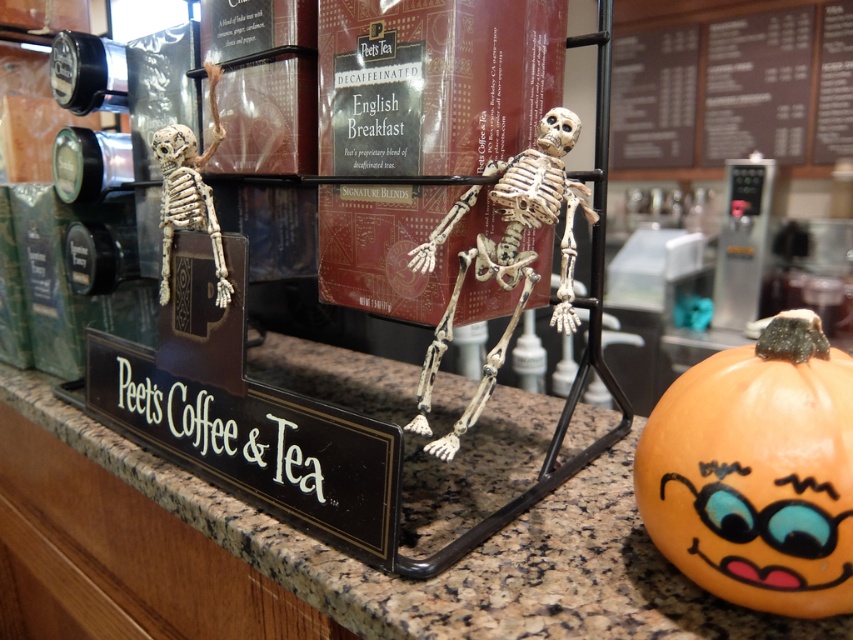
Question: Is the position of orange painted pumpkin at lower right less distant than that of dark brown wooden menu at upper right?

Choices:
 (A) no
 (B) yes

Answer: (B)

Question: Considering the real-world distances, which object is farthest from the white matte skeleton at left?

Choices:
 (A) granite countertop at center
 (B) orange painted pumpkin at lower right
 (C) dark brown wooden menu at upper right

Answer: (C)

Question: Is orange painted pumpkin at lower right below bone-like skeleton at center?

Choices:
 (A) yes
 (B) no

Answer: (A)

Question: Can you confirm if granite countertop at center is positioned below bone-like skeleton at center?

Choices:
 (A) yes
 (B) no

Answer: (A)

Question: Which of the following is the farthest from the observer?

Choices:
 (A) white matte skeleton at left
 (B) orange painted pumpkin at lower right
 (C) bone-like skeleton at center
 (D) granite countertop at center

Answer: (A)

Question: Which of these objects is positioned farthest from the white matte skeleton at left?

Choices:
 (A) dark brown wooden menu at upper right
 (B) bone-like skeleton at center

Answer: (A)